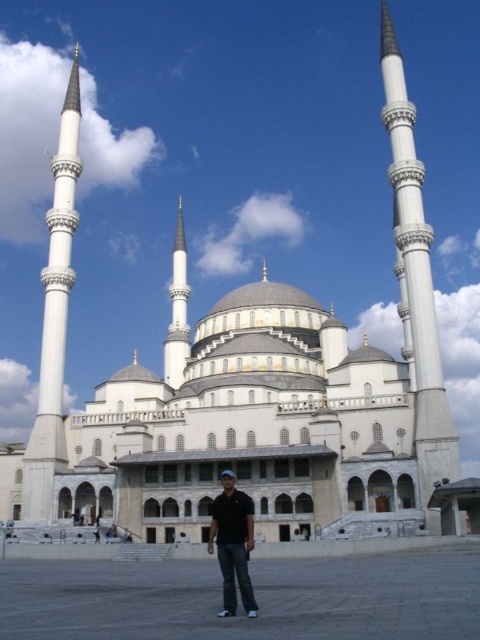
You are standing in front of the grand mosque and notice the white marble minaret at left and the black matte shirt at center. Which object is higher in the scene?

The white marble minaret at left is positioned over the black matte shirt at center, so it is higher in the scene.

You are an architect planning to add a new minaret to the mosque. You want to maintain symmetry between the existing white marble minaret at right and white marble minaret at left. Which existing minaret should you use as a reference for the new one?

To maintain symmetry, the new minaret should match the size of the white marble minaret at left, since the white marble minaret at right is smaller than it.